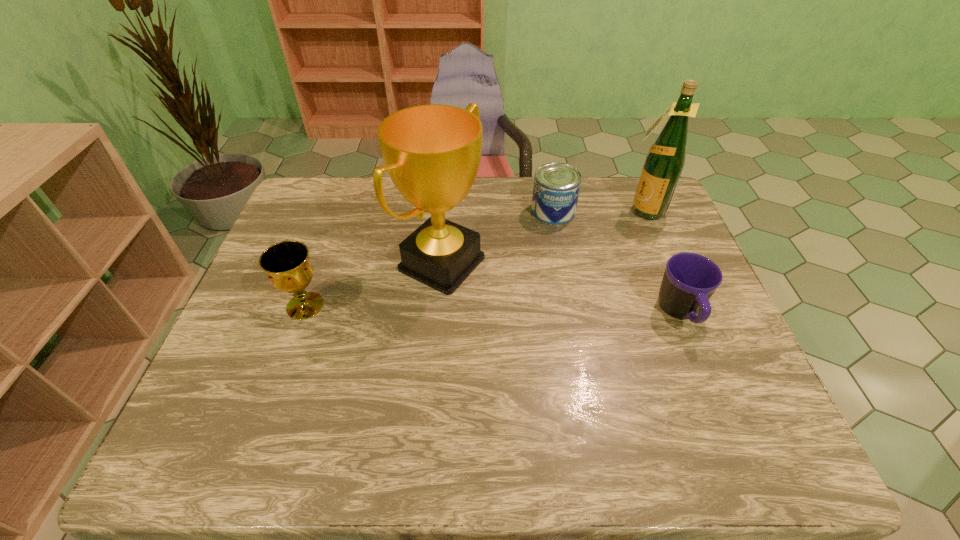
The height and width of the screenshot is (540, 960). Find the location of `chalice`. chalice is located at coordinates (287, 264).

I want to click on the third shortest object, so click(287, 264).

Identify the location of mug. (689, 281).

Where is `liquor`? liquor is located at coordinates (664, 163).

Where is `award`? This screenshot has height=540, width=960. award is located at coordinates (432, 153).

At what (x,y) coordinates should I click in order to perform the action: click on can. Please return your answer as a coordinate pair (x, y). The height and width of the screenshot is (540, 960). Looking at the image, I should click on (556, 188).

Find the location of `vacant space located on the back of the third shortest object`. vacant space located on the back of the third shortest object is located at coordinates (341, 208).

The height and width of the screenshot is (540, 960). I want to click on free space located with the handle on the side of the mug, so click(699, 360).

This screenshot has height=540, width=960. Find the location of `vacant space located 0.320m on the front-facing side of the liquor`. vacant space located 0.320m on the front-facing side of the liquor is located at coordinates click(573, 271).

You are a GUI agent. You are given a task and a screenshot of the screen. Output one action in this format:
    pyautogui.click(x=<x>, y=<y>)
    Task: Click on the vacant space located 0.100m on the front-facing side of the liquor
    The image size is (960, 540).
    Given the screenshot: What is the action you would take?
    pyautogui.click(x=614, y=234)